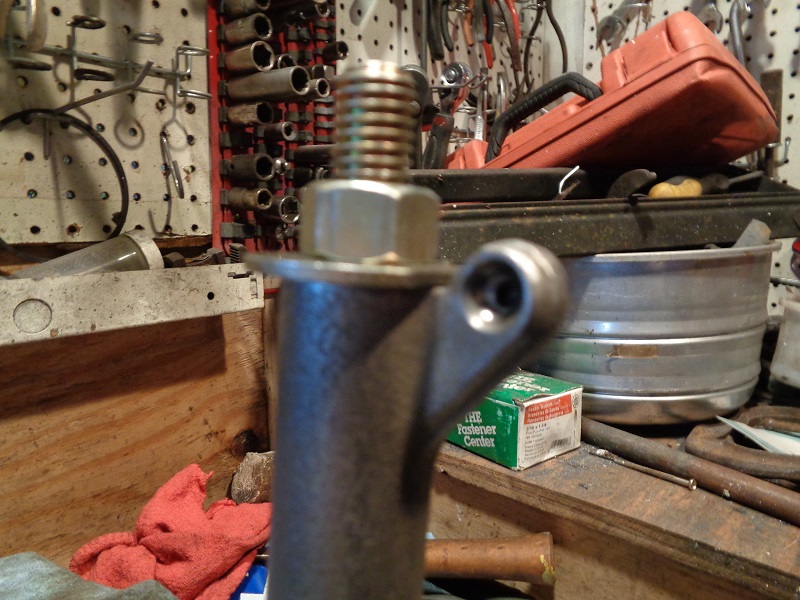
In order to click on handle in this screenshot , I will do `click(470, 565)`.